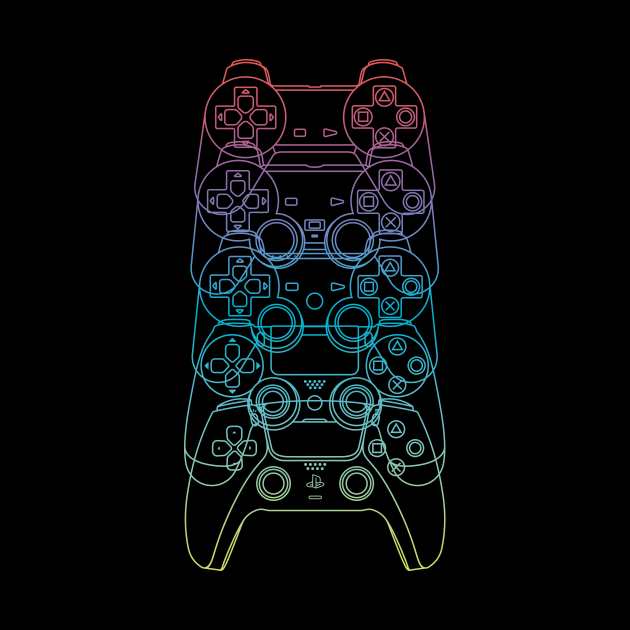
You are a GUI agent. You are given a task and a screenshot of the screen. Output one action in this format:
    pyautogui.click(x=<x>, y=<y>)
    Task: Click on the handle
    Image resolution: width=630 pixels, height=630 pixels.
    Given the screenshot: What is the action you would take?
    pyautogui.click(x=441, y=532), pyautogui.click(x=236, y=527), pyautogui.click(x=213, y=441), pyautogui.click(x=421, y=440), pyautogui.click(x=420, y=323), pyautogui.click(x=231, y=338), pyautogui.click(x=227, y=249), pyautogui.click(x=421, y=238), pyautogui.click(x=402, y=175), pyautogui.click(x=231, y=198)